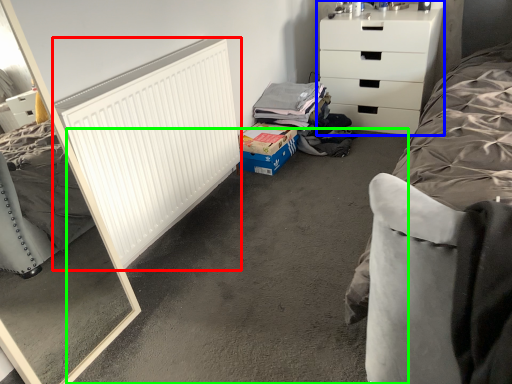
Question: Which is farther away from radiator (highlighted by a red box)? chest of drawers (highlighted by a blue box) or concrete (highlighted by a green box)?

Choices:
 (A) chest of drawers
 (B) concrete

Answer: (A)